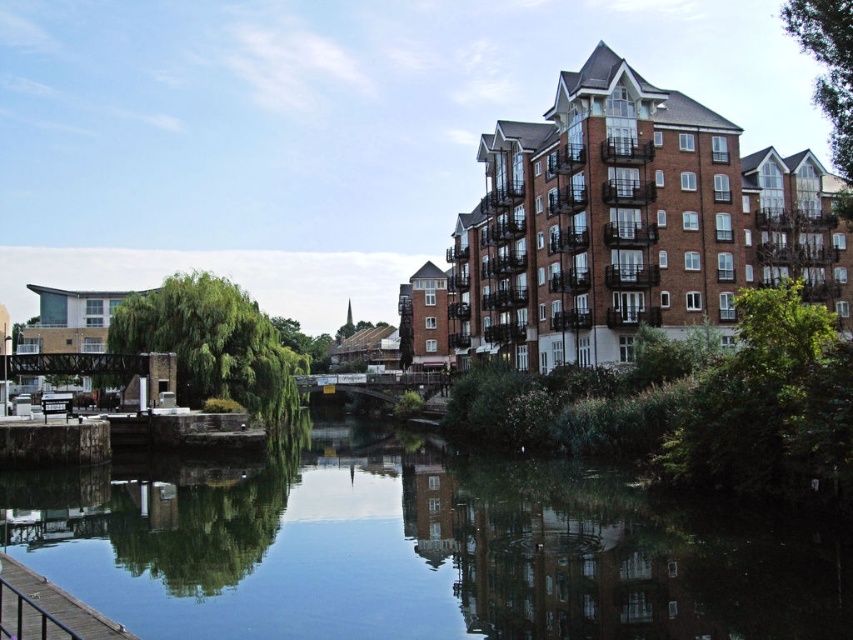
Can you confirm if smooth reflective water at center is positioned to the left of brown wooden dock at lower left?

In fact, smooth reflective water at center is to the right of brown wooden dock at lower left.

Image resolution: width=853 pixels, height=640 pixels. Identify the location of smooth reflective water at center. (415, 548).